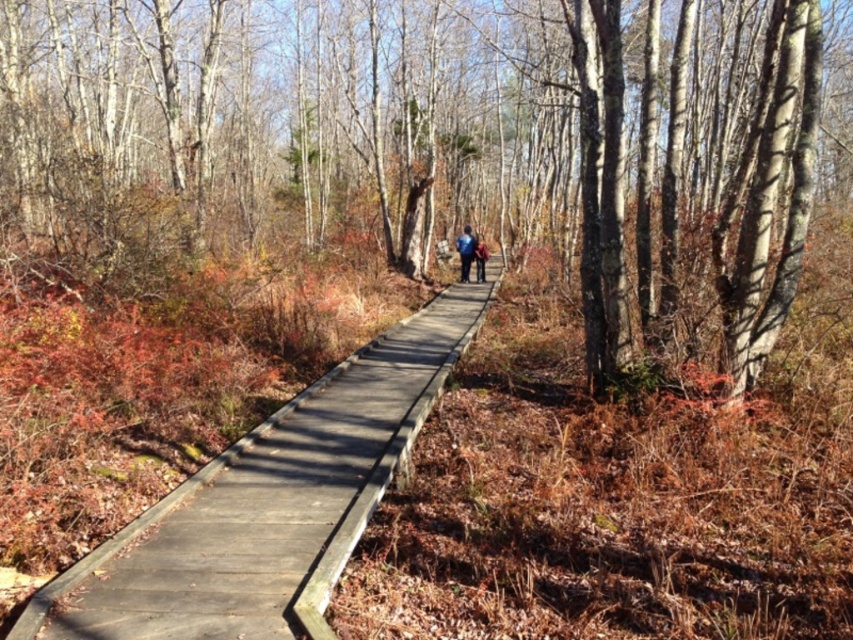
Which is behind, point (349, 36) or point (404, 344)?

The point (349, 36) is more distant.

Does point (450, 125) lie in front of point (395, 397)?

No, (450, 125) is further to viewer.

This screenshot has height=640, width=853. Describe the element at coordinates (438, 134) in the screenshot. I see `smooth bark tree at center` at that location.

This screenshot has width=853, height=640. Find the location of `smooth bark tree at center`. smooth bark tree at center is located at coordinates (438, 134).

Is wooden boardwalk at center positioned at the back of dark blue jacket at center?

No.

Does wooden boardwalk at center appear on the left side of dark blue jacket at center?

Correct, you'll find wooden boardwalk at center to the left of dark blue jacket at center.

Between point (56, 600) and point (485, 259), which one is positioned in front?

Point (56, 600) is more forward.

This screenshot has height=640, width=853. Find the location of `wooden boardwalk at center`. wooden boardwalk at center is located at coordinates (270, 502).

Which is behind, point (461, 275) or point (485, 259)?

Point (461, 275)

Which is in front, point (471, 236) or point (477, 268)?

Point (471, 236) is in front.

Identify the location of blue fabric jacket at center. The width and height of the screenshot is (853, 640). (465, 252).